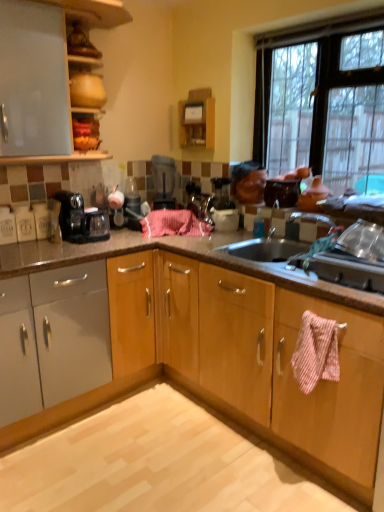
Question: In the image, is clear glass window at upper right positioned in front of or behind matte white cabinet at upper left?

Choices:
 (A) front
 (B) behind

Answer: (A)

Question: Does point (311, 142) appear closer or farther from the camera than point (26, 33)?

Choices:
 (A) farther
 (B) closer

Answer: (A)

Question: Estimate the real-world distances between objects in this image. Which object is farther from the black plastic coffee maker at left?

Choices:
 (A) matte white cabinet at upper left
 (B) clear glass window at upper right
 (C) light brown polished granite at lower center
 (D) metallic silver sink at right
 (E) pink woven towel at center, which is the 1th blanket in left-to-right order

Answer: (D)

Question: Which object is positioned closest to the metallic silver sink at right?

Choices:
 (A) matte white cabinet at upper left
 (B) light brown polished granite at lower center
 (C) black plastic blender at center
 (D) black plastic coffee maker at left
 (E) pink striped towel at lower right, placed as the second blanket when sorted from left to right

Answer: (E)